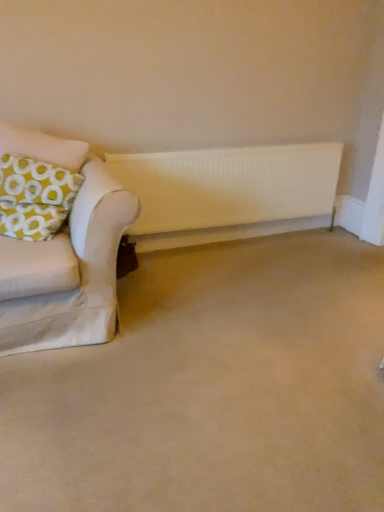
What do you see at coordinates (228, 192) in the screenshot?
I see `white matte radiator at center` at bounding box center [228, 192].

The height and width of the screenshot is (512, 384). What do you see at coordinates (35, 197) in the screenshot? I see `yellow-green fabric pillow at left` at bounding box center [35, 197].

Find the location of a particular element. beige carpet at lower center is located at coordinates (212, 388).

Considering the relative sizes of yellow-green fabric pillow at left and white matte radiator at center in the image provided, is yellow-green fabric pillow at left bigger than white matte radiator at center?

Yes.

From the picture: Are yellow-green fabric pillow at left and white matte radiator at center making contact?

No, yellow-green fabric pillow at left is not in contact with white matte radiator at center.

From their relative heights in the image, would you say yellow-green fabric pillow at left is taller or shorter than white matte radiator at center?

yellow-green fabric pillow at left is shorter than white matte radiator at center.

Is yellow-green fabric pillow at left positioned beyond the bounds of white matte radiator at center?

Yes.

How many degrees apart are the facing directions of yellow-green fabric pillow at left and beige carpet at lower center?

The facing directions of yellow-green fabric pillow at left and beige carpet at lower center are 98.7 degrees apart.

Is yellow-green fabric pillow at left bigger or smaller than beige carpet at lower center?

Considering their sizes, yellow-green fabric pillow at left takes up less space than beige carpet at lower center.

How much distance is there between yellow-green fabric pillow at left and beige carpet at lower center?

yellow-green fabric pillow at left and beige carpet at lower center are 83.37 centimeters apart.

Between yellow-green fabric pillow at left and beige carpet at lower center, which one has smaller width?

Thinner between the two is yellow-green fabric pillow at left.

Considering the relative sizes of beige carpet at lower center and yellow-green fabric pillow at left in the image provided, is beige carpet at lower center thinner than yellow-green fabric pillow at left?

No, beige carpet at lower center is not thinner than yellow-green fabric pillow at left.

From a real-world perspective, between beige carpet at lower center and yellow-green fabric pillow at left, who is vertically lower?

beige carpet at lower center.

Which is less distant, (48, 392) or (56, 186)?

Point (48, 392) is closer to the camera than point (56, 186).

Would you say beige carpet at lower center is inside or outside yellow-green fabric pillow at left?

beige carpet at lower center is spatially situated outside yellow-green fabric pillow at left.

Based on their positions, is beige carpet at lower center located to the left or right of white matte radiator at center?

Based on their positions, beige carpet at lower center is located to the right of white matte radiator at center.

From the image's perspective, would you say beige carpet at lower center is shown under white matte radiator at center?

Correct, beige carpet at lower center appears lower than white matte radiator at center in the image.

Can you confirm if beige carpet at lower center is wider than white matte radiator at center?

Correct, the width of beige carpet at lower center exceeds that of white matte radiator at center.

How many degrees apart are the facing directions of beige carpet at lower center and white matte radiator at center?

The angular difference between beige carpet at lower center and white matte radiator at center is 89.9 degrees.

Which is in front, point (219, 181) or point (66, 188)?

Point (66, 188)

Can you confirm if white matte radiator at center is shorter than yellow-green fabric pillow at left?

Incorrect, the height of white matte radiator at center does not fall short of that of yellow-green fabric pillow at left.

Are white matte radiator at center and yellow-green fabric pillow at left located far from each other?

white matte radiator at center is actually quite close to yellow-green fabric pillow at left.

Is white matte radiator at center positioned far away from beige carpet at lower center?

No, white matte radiator at center is not far from beige carpet at lower center.

Can you confirm if white matte radiator at center is positioned to the right of beige carpet at lower center?

In fact, white matte radiator at center is to the left of beige carpet at lower center.

From a real-world perspective, does white matte radiator at center sit lower than beige carpet at lower center?

Actually, white matte radiator at center is physically above beige carpet at lower center in the real world.

Considering the positions of points (311, 210) and (383, 453), is point (311, 210) closer to camera compared to point (383, 453)?

No, (311, 210) is further to viewer.

Where is `pillow above the white matte radiator at center (from the image's perspective)`? The height and width of the screenshot is (512, 384). pillow above the white matte radiator at center (from the image's perspective) is located at coordinates (35, 197).

Locate an element on the screen. pillow on the left of beige carpet at lower center is located at coordinates (35, 197).

Consider the image. Which object lies further to the anchor point white matte radiator at center, yellow-green fabric pillow at left or beige carpet at lower center?

beige carpet at lower center lies further to white matte radiator at center than the other object.

From the image, which object appears to be farther from yellow-green fabric pillow at left, white matte radiator at center or beige carpet at lower center?

Based on the image, white matte radiator at center appears to be further to yellow-green fabric pillow at left.

When comparing their distances from beige carpet at lower center, does yellow-green fabric pillow at left or white matte radiator at center seem further?

The object further to beige carpet at lower center is white matte radiator at center.

Estimate the real-world distances between objects in this image. Which object is closer to beige carpet at lower center, white matte radiator at center or yellow-green fabric pillow at left?

Based on the image, yellow-green fabric pillow at left appears to be nearer to beige carpet at lower center.

Considering their positions, is beige carpet at lower center positioned closer to yellow-green fabric pillow at left than white matte radiator at center?

beige carpet at lower center.

Estimate the real-world distances between objects in this image. Which object is further from white matte radiator at center, beige carpet at lower center or yellow-green fabric pillow at left?

The object further to white matte radiator at center is beige carpet at lower center.

Locate an element on the screen. pillow between beige carpet at lower center and white matte radiator at center from front to back is located at coordinates (35, 197).